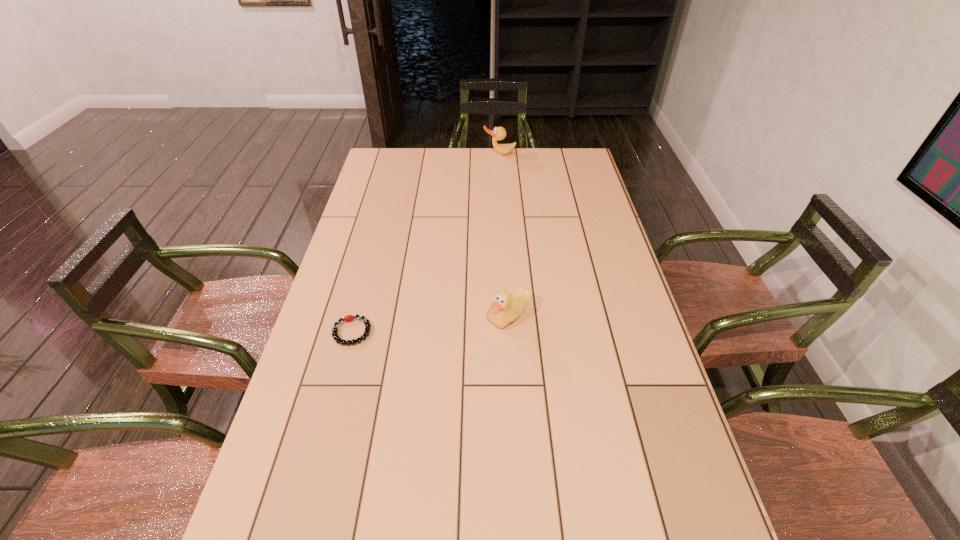
The width and height of the screenshot is (960, 540). Find the location of `object positioned at the left edge`. object positioned at the left edge is located at coordinates (348, 318).

Identify the location of free region at the far edge. (455, 153).

In the image, there is a desktop. Identify the location of free space at the left edge. (388, 274).

In the image, there is a desktop. Where is `vacant space at the right edge`? vacant space at the right edge is located at coordinates (584, 241).

Locate an element on the screen. The height and width of the screenshot is (540, 960). free area in between the nearer duck and the farthest object is located at coordinates (504, 235).

You are a GUI agent. You are given a task and a screenshot of the screen. Output one action in this format:
    pyautogui.click(x=<x>, y=<y>)
    Task: Click on the free point between the bracelet and the farther duck
    The height and width of the screenshot is (540, 960).
    Given the screenshot: What is the action you would take?
    pyautogui.click(x=426, y=242)

At what (x,y) coordinates should I click in order to perform the action: click on free point between the farther duck and the nearer duck. Please return your answer as a coordinate pair (x, y). Looking at the image, I should click on (504, 235).

The height and width of the screenshot is (540, 960). I want to click on free space between the leftmost object and the nearer duck, so coord(430,324).

You are a GUI agent. You are given a task and a screenshot of the screen. Output one action in this format:
    pyautogui.click(x=<x>, y=<y>)
    Task: Click on the vacant space that's between the nearer duck and the farthest object
    
    Given the screenshot: What is the action you would take?
    pyautogui.click(x=504, y=235)

The width and height of the screenshot is (960, 540). What are the coordinates of `blank region between the nearer duck and the leftmost object` in the screenshot? It's located at (430, 324).